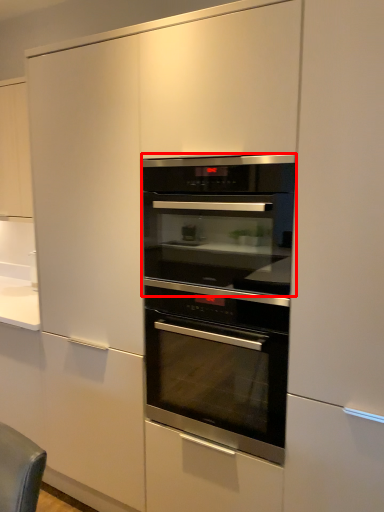
Question: From the image's perspective, where is oven (annotated by the red box) located relative to oven?

Choices:
 (A) above
 (B) below

Answer: (A)